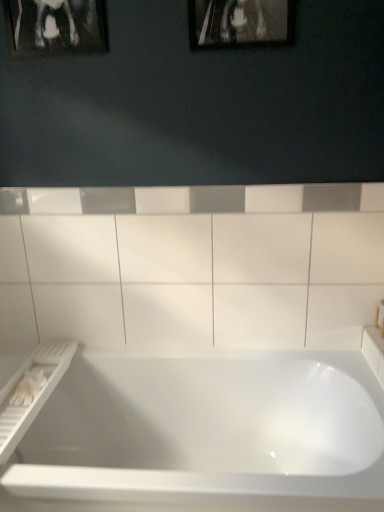
Locate an element on the screen. The width and height of the screenshot is (384, 512). empty space that is ontop of white glossy ceramic tile at center (from a real-world perspective) is located at coordinates (175, 187).